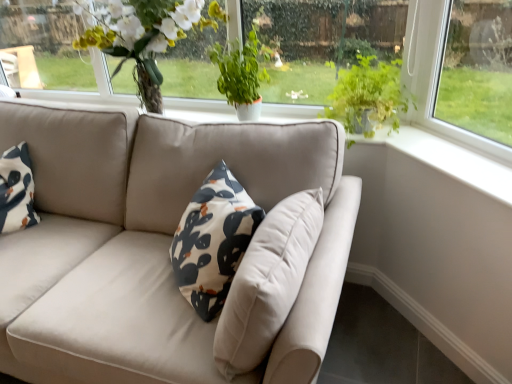
Question: Is green leafy plant at center, placed as the 2th houseplant when sorted from right to left, inside or outside of green leafy plant at upper right, marked as the first houseplant in a right-to-left arrangement?

Choices:
 (A) outside
 (B) inside

Answer: (A)

Question: From the image's perspective, relative to green leafy plant at upper right, which appears as the second houseplant when viewed from the left, is green leafy plant at center, placed as the 2th houseplant when sorted from right to left, above or below?

Choices:
 (A) above
 (B) below

Answer: (A)

Question: Which object is the closest to the green leafy plant at upper center?

Choices:
 (A) green leafy plant at center, arranged as the 1th houseplant when viewed from the left
 (B) matte white vase at upper center
 (C) green leafy plant at upper right, marked as the first houseplant in a right-to-left arrangement

Answer: (C)

Question: Which object is positioned farthest from the green leafy plant at upper center?

Choices:
 (A) green leafy plant at center, arranged as the 1th houseplant when viewed from the left
 (B) matte white vase at upper center
 (C) green leafy plant at upper right, marked as the first houseplant in a right-to-left arrangement

Answer: (B)